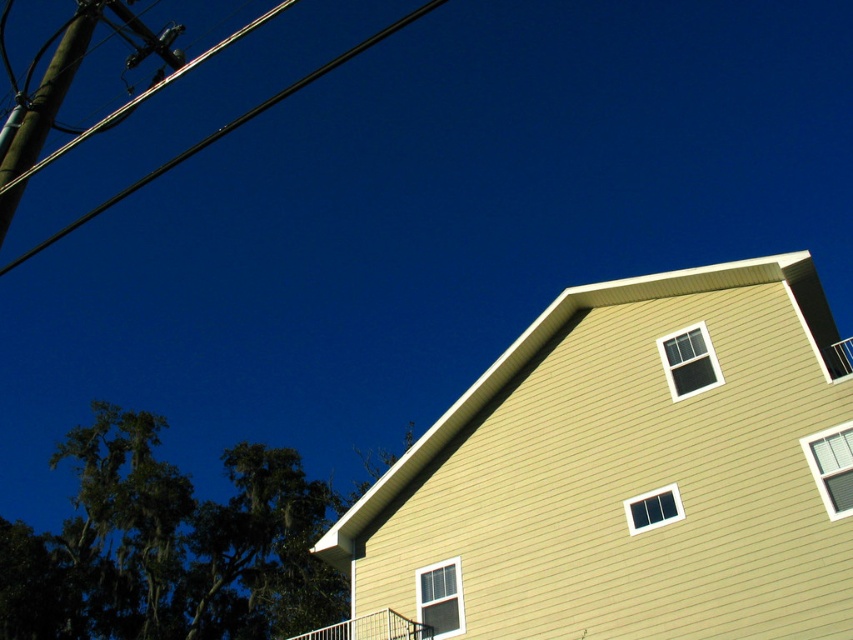
Question: Is brown wooden telegraph pole at upper left positioned in front of black wire at upper left?

Choices:
 (A) yes
 (B) no

Answer: (A)

Question: Which point appears farthest from the camera in this image?

Choices:
 (A) (68, 76)
 (B) (54, 236)

Answer: (B)

Question: Does brown wooden telegraph pole at upper left come behind black wire at upper left?

Choices:
 (A) no
 (B) yes

Answer: (A)

Question: Among these points, which one is nearest to the camera?

Choices:
 (A) (253, 113)
 (B) (67, 42)

Answer: (B)

Question: Can you confirm if brown wooden telegraph pole at upper left is positioned to the right of black wire at upper left?

Choices:
 (A) no
 (B) yes

Answer: (B)